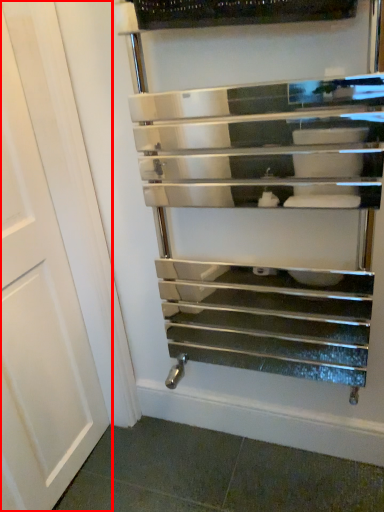
Question: From the image, what is the correct spatial relationship of door (annotated by the red box) in relation to shelf?

Choices:
 (A) left
 (B) right

Answer: (A)